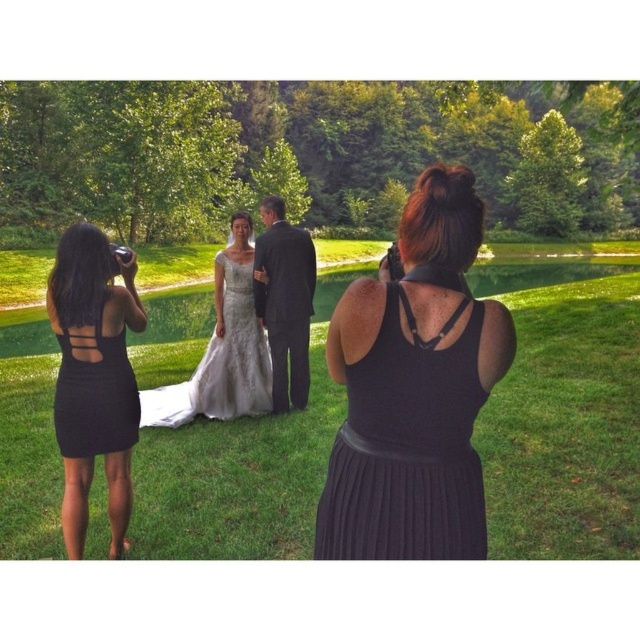
You are a guest at the wedding and want to take a photo with the photographers. Which dress is taller between the black mesh dress at left and the black ribbed dress at left?

The black mesh dress at left is much taller than the black ribbed dress at left.

You are a photographer at the wedding and want to ensure you have enough space between you and the other photographer to move freely. The minimum space you need is 0.5 meters. Given the black ribbed dress at center and the black mesh dress at left, can you determine if there is enough space between them?

The black ribbed dress at center is narrower than the black mesh dress at left. Since the black ribbed dress at center has a smaller width, there is likely enough space between them to move freely as the required 0.5 meters might be accommodated depending on their positioning.

You are a photographer at the wedding and need to decide which dress to choose between the black mesh dress at left and the black ribbed dress at left based on their widths. Which dress is wider?

The black mesh dress at left is wider than the black ribbed dress at left.